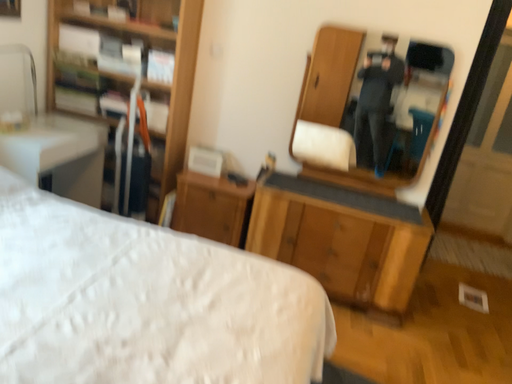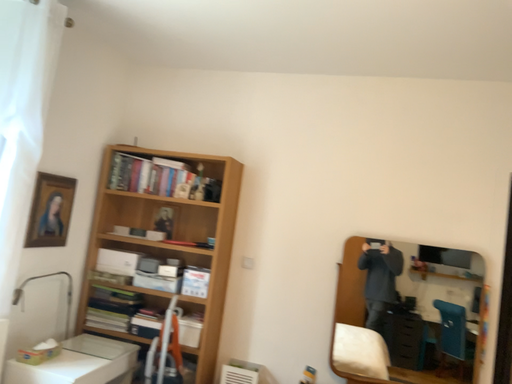
Question: Which way did the camera rotate in the video?

Choices:
 (A) rotated upward
 (B) rotated downward

Answer: (A)